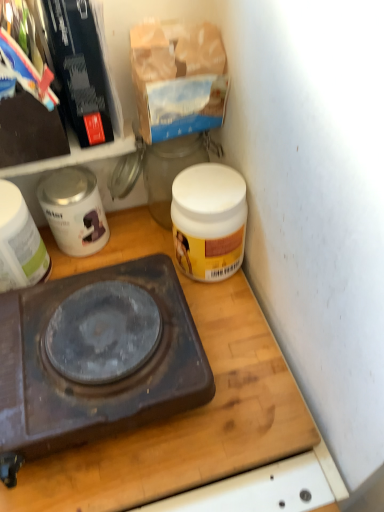
Question: Is dark brown plastic gas stove at center wider or thinner than white glossy canister at upper left, placed as the first appliance when sorted from right to left?

Choices:
 (A) thin
 (B) wide

Answer: (B)

Question: Do you think dark brown plastic gas stove at center is within white glossy canister at upper left, placed as the first appliance when sorted from right to left, or outside of it?

Choices:
 (A) outside
 (B) inside

Answer: (A)

Question: Considering the real-world distances, which object is farthest from the white glossy canister at upper left, the 2th appliance positioned from the left?

Choices:
 (A) wooden cutting board at center
 (B) white matte jar at upper right
 (C) white glossy jar at left, the first appliance positioned from the left
 (D) dark brown plastic gas stove at center

Answer: (A)

Question: Which is nearer to the white matte jar at upper right?

Choices:
 (A) white glossy jar at left, arranged as the 2th appliance when viewed from the right
 (B) dark brown plastic gas stove at center
 (C) wooden cutting board at center
 (D) white glossy canister at upper left, placed as the first appliance when sorted from right to left

Answer: (C)